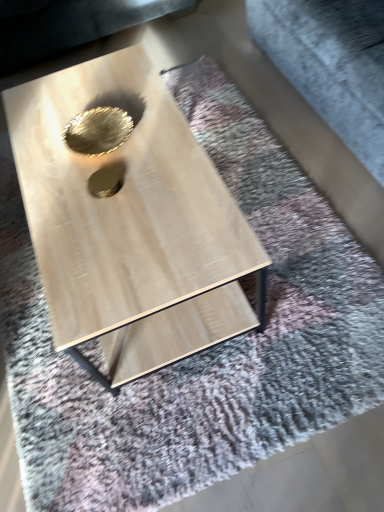
Image resolution: width=384 pixels, height=512 pixels. In order to click on free spot below gold metallic hole at center, which appears as the 2th hole when ordered from the bottom (from a real-world perspective) in this screenshot , I will do `click(102, 137)`.